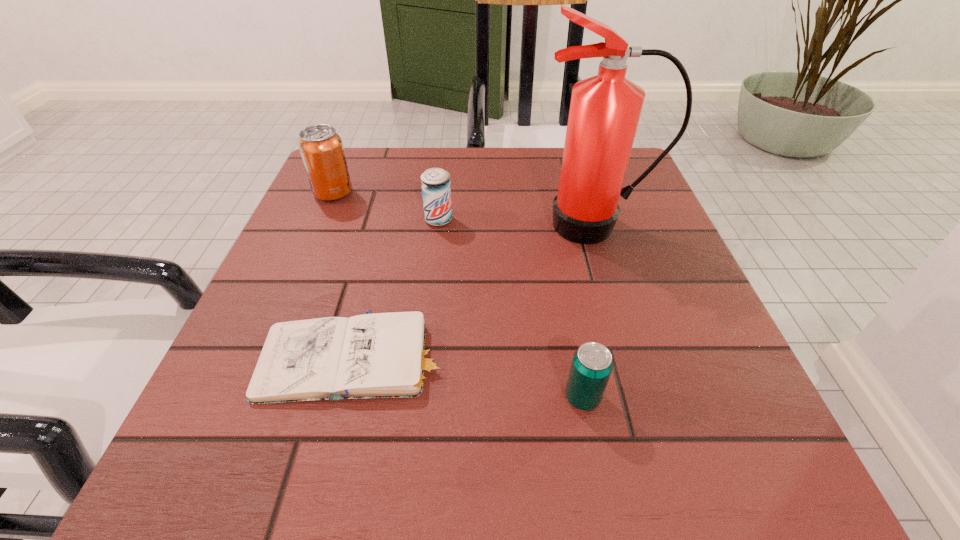
I want to click on vacant space that's between the soda can and the tallest object, so (465, 210).

Where is `unoccupied area between the left beer can and the tallest object`? unoccupied area between the left beer can and the tallest object is located at coordinates [516, 223].

The height and width of the screenshot is (540, 960). In order to click on vacant area that lies between the left beer can and the right beer can in this screenshot , I will do `click(511, 308)`.

Find the location of a particular element. vacant space that is in between the shortest object and the left beer can is located at coordinates (397, 287).

What are the coordinates of `vacant space in between the fire extinguisher and the notebook` in the screenshot? It's located at (475, 291).

You are a GUI agent. You are given a task and a screenshot of the screen. Output one action in this format:
    pyautogui.click(x=<x>, y=<y>)
    Task: Click on the free space between the tallest object and the farthest object
    
    Given the screenshot: What is the action you would take?
    pyautogui.click(x=465, y=210)

Identify the location of free space between the shortest object and the nearer beer can. coord(469,376).

This screenshot has width=960, height=540. In order to click on free area in between the farthest object and the shortest object in this screenshot , I will do `click(345, 274)`.

This screenshot has width=960, height=540. Identify the location of vacant region between the tallest object and the notebook. (475, 291).

Where is `free space between the fire extinguisher and the right beer can`? This screenshot has width=960, height=540. free space between the fire extinguisher and the right beer can is located at coordinates (588, 312).